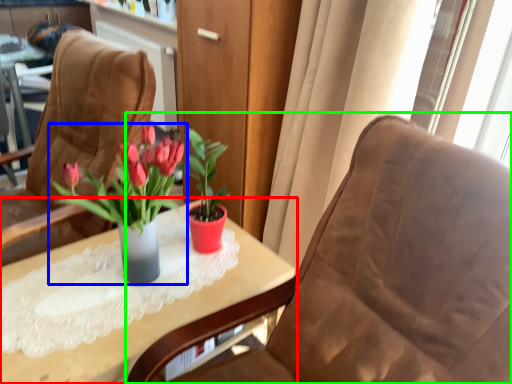
Question: Based on their relative distances, which object is nearer to table (highlighted by a red box)? Choose from houseplant (highlighted by a blue box) and chair (highlighted by a green box).

Choices:
 (A) houseplant
 (B) chair

Answer: (A)